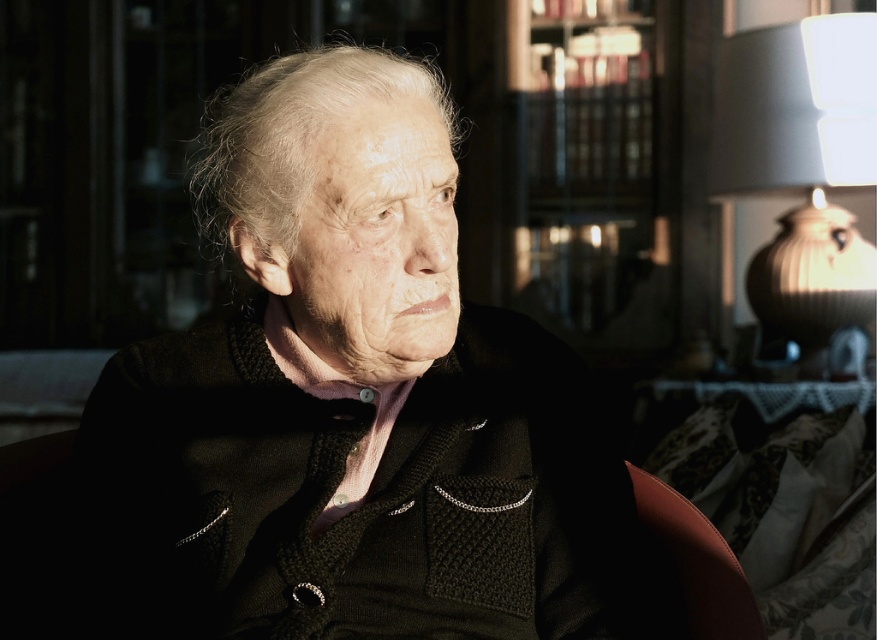
Is knitted black sweater at center shorter than white matte hair at center?

No, knitted black sweater at center is not shorter than white matte hair at center.

Does point (567, 627) lie in front of point (307, 118)?

That is False.

Between point (469, 548) and point (255, 68), which one is positioned in front?

Point (469, 548)

I want to click on knitted black sweater at center, so click(351, 404).

Is knitted black sweater at center below white ceramic lamp at upper right?

Yes, knitted black sweater at center is below white ceramic lamp at upper right.

Between point (515, 522) and point (820, 92), which one is positioned behind?

The point (820, 92) is more distant.

Where is `knitted black sweater at center`? The height and width of the screenshot is (640, 877). knitted black sweater at center is located at coordinates (351, 404).

Image resolution: width=877 pixels, height=640 pixels. In order to click on knitted black sweater at center in this screenshot , I will do `click(351, 404)`.

Does white matte hair at center appear on the right side of leather at right?

No, white matte hair at center is not to the right of leather at right.

Does white matte hair at center have a larger size compared to leather at right?

Yes, white matte hair at center is bigger than leather at right.

Between point (398, 83) and point (658, 531), which one is positioned in front?

Point (398, 83) is in front.

This screenshot has width=877, height=640. Find the location of `white matte hair at center`. white matte hair at center is located at coordinates (291, 134).